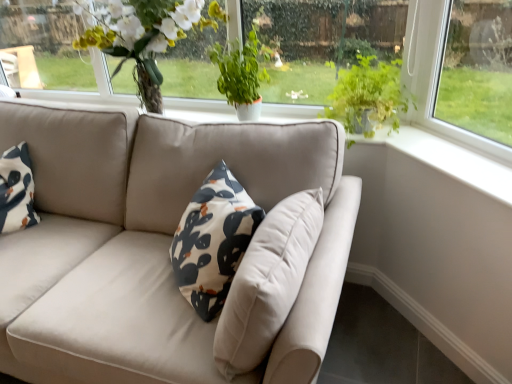
Locate an element on the screen. green leafy plant at upper right, marked as the first houseplant in a right-to-left arrangement is located at coordinates (369, 97).

You are a GUI agent. You are given a task and a screenshot of the screen. Output one action in this format:
    pyautogui.click(x=<x>, y=<y>)
    Task: Click on the green leafy plant at center, arranged as the 1th houseplant when viewed from the left
    The height and width of the screenshot is (384, 512).
    Given the screenshot: What is the action you would take?
    pyautogui.click(x=241, y=74)

Find the location of a particular element. The height and width of the screenshot is (384, 512). green leafy plant at upper center is located at coordinates (322, 41).

Measure the distance between green leafy plant at upper center and camera.

The depth of green leafy plant at upper center is 1.71 meters.

At what (x,y) coordinates should I click in order to perform the action: click on matte white vase at upper center. Please return your answer as a coordinate pair (x, y). This screenshot has height=384, width=512. Looking at the image, I should click on (144, 36).

From a real-world perspective, which object stands above the other?

green leafy plant at upper center.

From the image's perspective, is green leafy plant at upper right, which appears as the second houseplant when viewed from the left, over green leafy plant at upper center?

No, from the image's perspective, green leafy plant at upper right, which appears as the second houseplant when viewed from the left, is not on top of green leafy plant at upper center.

Is green leafy plant at upper right, marked as the first houseplant in a right-to-left arrangement, spatially inside green leafy plant at upper center, or outside of it?

green leafy plant at upper right, marked as the first houseplant in a right-to-left arrangement, cannot be found inside green leafy plant at upper center.

Does green leafy plant at upper right, which appears as the second houseplant when viewed from the left, turn towards green leafy plant at upper center?

No, green leafy plant at upper right, which appears as the second houseplant when viewed from the left, is not facing towards green leafy plant at upper center.

Considering the sizes of objects green leafy plant at upper right, marked as the first houseplant in a right-to-left arrangement, and green leafy plant at center, placed as the 2th houseplant when sorted from right to left, in the image provided, who is taller, green leafy plant at upper right, marked as the first houseplant in a right-to-left arrangement, or green leafy plant at center, placed as the 2th houseplant when sorted from right to left,?

Standing taller between the two is green leafy plant at center, placed as the 2th houseplant when sorted from right to left.

Which is more to the right, green leafy plant at upper right, marked as the first houseplant in a right-to-left arrangement, or green leafy plant at center, arranged as the 1th houseplant when viewed from the left?

Positioned to the right is green leafy plant at upper right, marked as the first houseplant in a right-to-left arrangement.

Is green leafy plant at upper right, marked as the first houseplant in a right-to-left arrangement, closer to camera compared to green leafy plant at center, arranged as the 1th houseplant when viewed from the left?

Yes, the depth of green leafy plant at upper right, marked as the first houseplant in a right-to-left arrangement, is less than that of green leafy plant at center, arranged as the 1th houseplant when viewed from the left.

Visually, is green leafy plant at upper center positioned to the left or to the right of green leafy plant at upper right, marked as the first houseplant in a right-to-left arrangement?

From the image, it's evident that green leafy plant at upper center is to the left of green leafy plant at upper right, marked as the first houseplant in a right-to-left arrangement.

Is green leafy plant at upper center positioned beyond the bounds of green leafy plant at upper right, marked as the first houseplant in a right-to-left arrangement?

Indeed, green leafy plant at upper center is completely outside green leafy plant at upper right, marked as the first houseplant in a right-to-left arrangement.

Which is behind, point (317, 27) or point (341, 87)?

The point (341, 87) is farther from the camera.

From the picture: Who is taller, green leafy plant at upper center or green leafy plant at upper right, which appears as the second houseplant when viewed from the left?

Standing taller between the two is green leafy plant at upper center.

Who is shorter, matte white vase at upper center or green leafy plant at upper center?

Standing shorter between the two is green leafy plant at upper center.

From a real-world perspective, which is physically above, matte white vase at upper center or green leafy plant at upper center?

matte white vase at upper center is physically above.

Is matte white vase at upper center not inside green leafy plant at upper center?

matte white vase at upper center is positioned outside green leafy plant at upper center.

Is matte white vase at upper center positioned with its back to green leafy plant at upper center?

matte white vase at upper center is not turned away from green leafy plant at upper center.

From a real-world perspective, relative to green leafy plant at upper right, which appears as the second houseplant when viewed from the left, is matte white vase at upper center vertically above or below?

In terms of real-world spatial position, matte white vase at upper center is above green leafy plant at upper right, which appears as the second houseplant when viewed from the left.

Is point (149, 93) positioned behind point (384, 99)?

Yes, it is.

Are matte white vase at upper center and green leafy plant at upper right, marked as the first houseplant in a right-to-left arrangement, making contact?

matte white vase at upper center and green leafy plant at upper right, marked as the first houseplant in a right-to-left arrangement, are not in contact.

Would you say green leafy plant at upper right, marked as the first houseplant in a right-to-left arrangement, is part of matte white vase at upper center's contents?

Actually, green leafy plant at upper right, marked as the first houseplant in a right-to-left arrangement, is outside matte white vase at upper center.

Is green leafy plant at upper center facing away from matte white vase at upper center?

No.

Is green leafy plant at upper center closer to the viewer compared to matte white vase at upper center?

No, it is behind matte white vase at upper center.

From the image's perspective, is green leafy plant at upper center located beneath matte white vase at upper center?

Yes, from the image's perspective, green leafy plant at upper center is below matte white vase at upper center.

From the image's perspective, is green leafy plant at center, placed as the 2th houseplant when sorted from right to left, below green leafy plant at upper center?

Yes, from the image's perspective, green leafy plant at center, placed as the 2th houseplant when sorted from right to left, is below green leafy plant at upper center.

Does green leafy plant at center, placed as the 2th houseplant when sorted from right to left, have a greater height compared to green leafy plant at upper center?

In fact, green leafy plant at center, placed as the 2th houseplant when sorted from right to left, may be shorter than green leafy plant at upper center.

Where is `houseplant that is the 1st object located below the green leafy plant at upper center (from the image's perspective)`? houseplant that is the 1st object located below the green leafy plant at upper center (from the image's perspective) is located at coordinates (241, 74).

Considering the sizes of green leafy plant at center, arranged as the 1th houseplant when viewed from the left, and green leafy plant at upper center in the image, is green leafy plant at center, arranged as the 1th houseplant when viewed from the left, wider or thinner than green leafy plant at upper center?

green leafy plant at center, arranged as the 1th houseplant when viewed from the left, is wider than green leafy plant at upper center.

Find the location of a particular element. window screen above the green leafy plant at upper right, which appears as the second houseplant when viewed from the left (from the image's perspective) is located at coordinates (322, 41).

I want to click on houseplant directly beneath the green leafy plant at center, arranged as the 1th houseplant when viewed from the left (from a real-world perspective), so click(x=369, y=97).

Looking at the image, which one is located further to green leafy plant at upper right, which appears as the second houseplant when viewed from the left, green leafy plant at upper center or matte white vase at upper center?

Based on the image, matte white vase at upper center appears to be further to green leafy plant at upper right, which appears as the second houseplant when viewed from the left.

Considering their positions, is matte white vase at upper center positioned closer to green leafy plant at center, arranged as the 1th houseplant when viewed from the left, than green leafy plant at upper right, which appears as the second houseplant when viewed from the left?

matte white vase at upper center.

Which object lies further to the anchor point matte white vase at upper center, green leafy plant at upper center or green leafy plant at center, arranged as the 1th houseplant when viewed from the left?

green leafy plant at upper center lies further to matte white vase at upper center than the other object.

Consider the image. Based on their spatial positions, is matte white vase at upper center or green leafy plant at upper right, marked as the first houseplant in a right-to-left arrangement, closer to green leafy plant at upper center?

Among the two, green leafy plant at upper right, marked as the first houseplant in a right-to-left arrangement, is located nearer to green leafy plant at upper center.

In the scene shown: Which object lies further to the anchor point green leafy plant at upper right, which appears as the second houseplant when viewed from the left, green leafy plant at center, placed as the 2th houseplant when sorted from right to left, or green leafy plant at upper center?

The object further to green leafy plant at upper right, which appears as the second houseplant when viewed from the left, is green leafy plant at center, placed as the 2th houseplant when sorted from right to left.

Estimate the real-world distances between objects in this image. Which object is further from matte white vase at upper center, green leafy plant at upper right, marked as the first houseplant in a right-to-left arrangement, or green leafy plant at upper center?

Based on the image, green leafy plant at upper right, marked as the first houseplant in a right-to-left arrangement, appears to be further to matte white vase at upper center.

From the image, which object appears to be farther from green leafy plant at center, placed as the 2th houseplant when sorted from right to left, green leafy plant at upper right, which appears as the second houseplant when viewed from the left, or green leafy plant at upper center?

green leafy plant at upper right, which appears as the second houseplant when viewed from the left, is positioned further to the anchor green leafy plant at center, placed as the 2th houseplant when sorted from right to left.

Estimate the real-world distances between objects in this image. Which object is closer to green leafy plant at upper center, matte white vase at upper center or green leafy plant at center, placed as the 2th houseplant when sorted from right to left?

green leafy plant at center, placed as the 2th houseplant when sorted from right to left.

You are a GUI agent. You are given a task and a screenshot of the screen. Output one action in this format:
    pyautogui.click(x=<x>, y=<y>)
    Task: Click on the window screen between green leafy plant at center, placed as the 2th houseplant when sorted from right to left, and green leafy plant at upper right, marked as the first houseplant in a right-to-left arrangement, in the horizontal direction
    This screenshot has height=384, width=512.
    Given the screenshot: What is the action you would take?
    pyautogui.click(x=322, y=41)

Identify the location of houseplant located between matte white vase at upper center and green leafy plant at upper center in the left-right direction. (241, 74).

The height and width of the screenshot is (384, 512). Find the location of `window screen situated between matte white vase at upper center and green leafy plant at upper right, which appears as the second houseplant when viewed from the left, from left to right`. window screen situated between matte white vase at upper center and green leafy plant at upper right, which appears as the second houseplant when viewed from the left, from left to right is located at coordinates (322, 41).

The height and width of the screenshot is (384, 512). I want to click on houseplant situated between matte white vase at upper center and green leafy plant at upper right, marked as the first houseplant in a right-to-left arrangement, from left to right, so click(x=241, y=74).